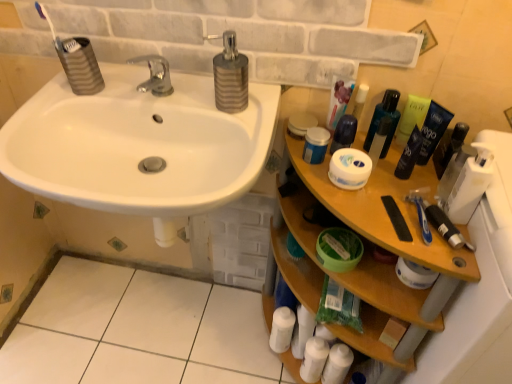
The width and height of the screenshot is (512, 384). What are the coordinates of `vacant space to the right of white matte jar at center` in the screenshot? It's located at (405, 187).